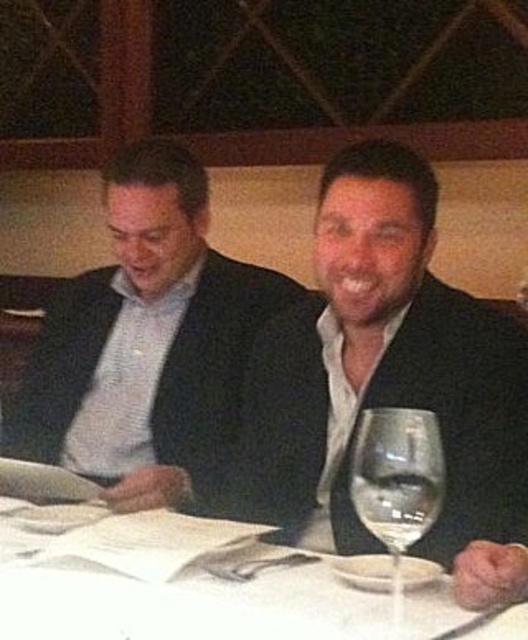
Question: Which object is the farthest from the clear glass wine glass at center?

Choices:
 (A) matte black suit at center
 (B) black matte suit at center

Answer: (A)

Question: Is matte black suit at center above clear glass wine glass at center?

Choices:
 (A) no
 (B) yes

Answer: (B)

Question: Does white paper at center have a smaller size compared to clear glass wine glass at center?

Choices:
 (A) no
 (B) yes

Answer: (A)

Question: Can you confirm if black matte suit at center is positioned to the right of white paper at center?

Choices:
 (A) no
 (B) yes

Answer: (B)

Question: Which of the following is the closest to the observer?

Choices:
 (A) (196, 524)
 (B) (418, 502)

Answer: (B)

Question: Considering the real-world distances, which object is farthest from the matte black suit at center?

Choices:
 (A) white paper at center
 (B) black matte suit at center
 (C) clear glass wine glass at center

Answer: (C)